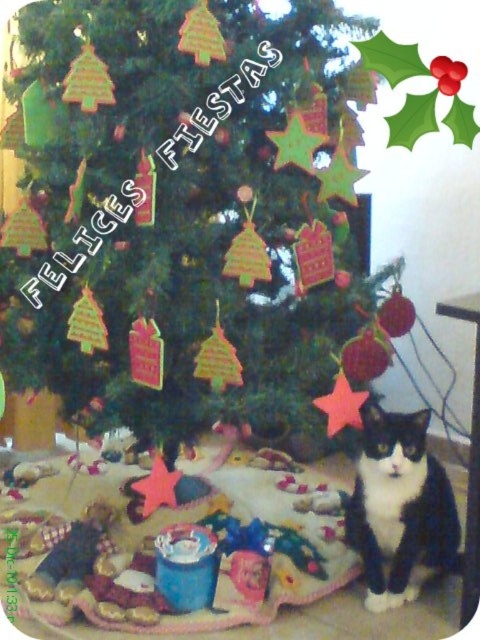
You are a guest at a Christmas party and want to take a photo with the green matte christmas tree at center and the black and white fur cat at lower right. Where should you stand to include both in the frame?

You should stand at a distance where both the green matte christmas tree at center and the black and white fur cat at lower right are visible. Since the green matte christmas tree at center is much taller than the black and white fur cat at lower right, positioning yourself slightly back from the tree will ensure both are in the frame.

You are a photographer standing in front of the green matte christmas tree at center and the black and white fur cat at lower right. You need to capture a photo that includes both subjects without cropping either of them. Based on their sizes, which subject should you position closer to the camera to ensure both fit in the frame?

The green matte christmas tree at center is wider than the black and white fur cat at lower right. To include both in the frame without cropping, position the black and white fur cat at lower right closer to the camera since it is narrower, allowing the wider tree to fit alongside it.

You are a child who is 1.3 meters tall. You want to see the top of the green matte christmas tree at center from where you are standing. Can you see the top of the tree?

The green matte christmas tree at center is 1.16 meters away from the viewer. Since the child is 1.3 meters tall, they can see the top of the tree as their height exceeds the distance to the tree.